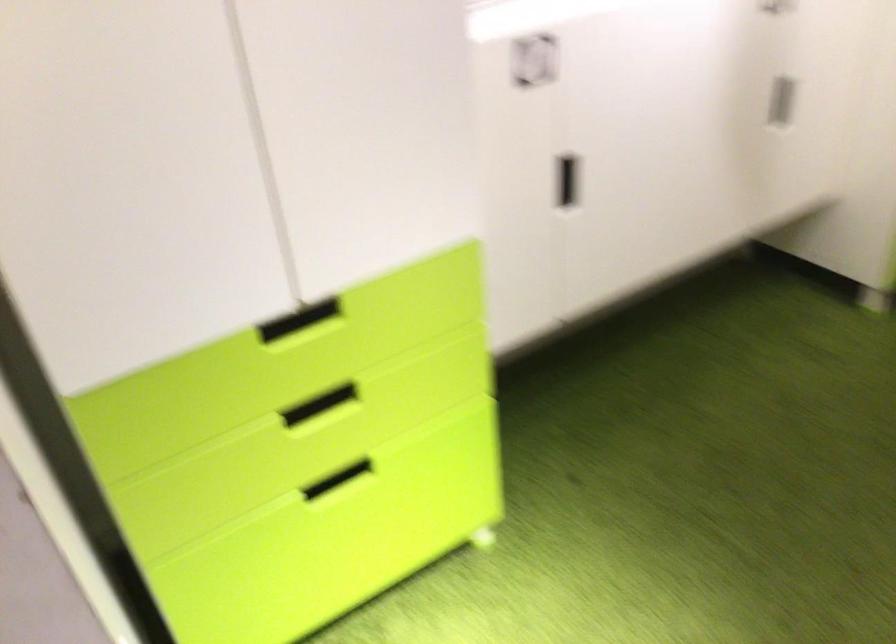
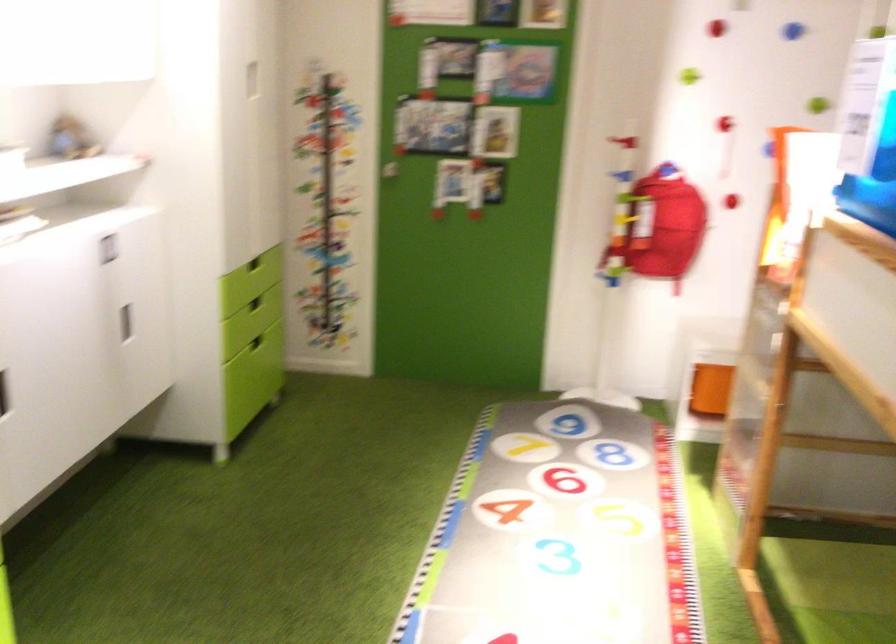
The point at (526,184) is marked in the first image. Where is the corresponding point in the second image?

(3, 393)